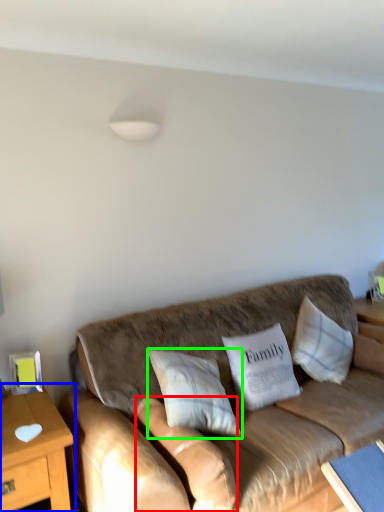
Question: Considering the real-world distances, which object is closest to pillow (highlighted by a red box)? table (highlighted by a blue box) or pillow (highlighted by a green box).

Choices:
 (A) table
 (B) pillow

Answer: (B)